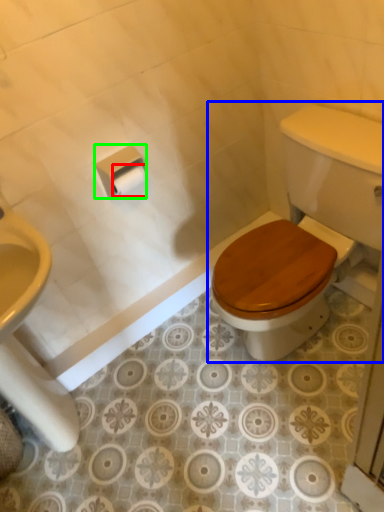
Question: Which object is positioned closest to toilet paper (highlighted by a red box)? Select from toilet (highlighted by a blue box) and toilet paper (highlighted by a green box).

Choices:
 (A) toilet
 (B) toilet paper

Answer: (B)